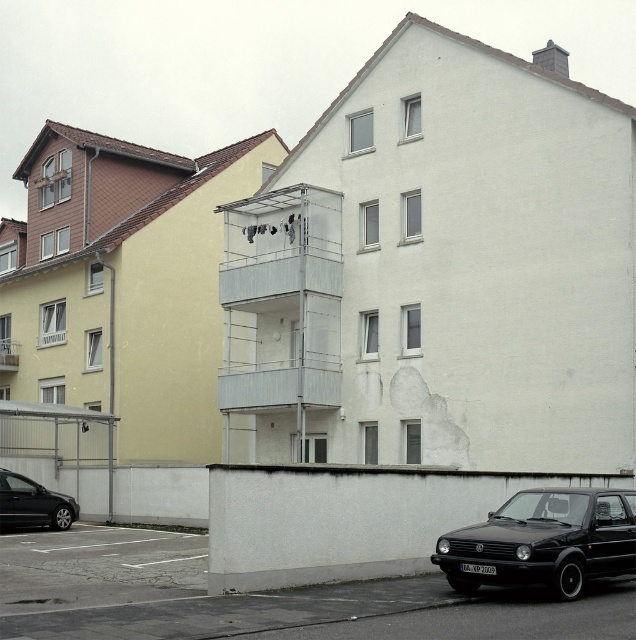
Which of these two, black matte hatchback at lower right or black matte car at lower left, stands shorter?

Standing shorter between the two is black matte hatchback at lower right.

Does black matte hatchback at lower right appear under black matte car at lower left?

Incorrect, black matte hatchback at lower right is not positioned below black matte car at lower left.

Locate an element on the screen. This screenshot has width=636, height=640. black matte hatchback at lower right is located at coordinates (544, 541).

Where is `black matte hatchback at lower right`? black matte hatchback at lower right is located at coordinates (544, 541).